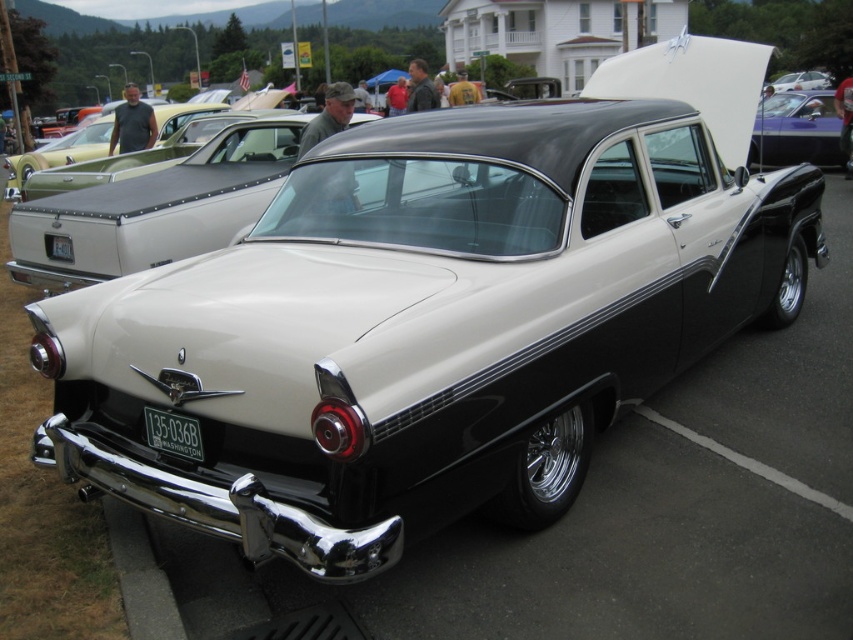
Identify the location of black metallic license plate at lower center. The image size is (853, 640). (173, 433).

Does black metallic license plate at lower center come behind green metallic license plate at rear?

That is False.

Locate an element on the screen. This screenshot has height=640, width=853. black metallic license plate at lower center is located at coordinates (173, 433).

Can you confirm if purple glossy car at upper right is wider than green metallic license plate at rear?

Indeed, purple glossy car at upper right has a greater width compared to green metallic license plate at rear.

Can you confirm if purple glossy car at upper right is shorter than green metallic license plate at rear?

No, purple glossy car at upper right is not shorter than green metallic license plate at rear.

Find the location of a particular element. The width and height of the screenshot is (853, 640). purple glossy car at upper right is located at coordinates (798, 131).

Where is `purple glossy car at upper right`? purple glossy car at upper right is located at coordinates (798, 131).

Is purple glossy car at upper right in front of black metallic license plate at lower center?

No, purple glossy car at upper right is behind black metallic license plate at lower center.

The height and width of the screenshot is (640, 853). What do you see at coordinates (798, 131) in the screenshot?
I see `purple glossy car at upper right` at bounding box center [798, 131].

Where is `purple glossy car at upper right`? purple glossy car at upper right is located at coordinates (798, 131).